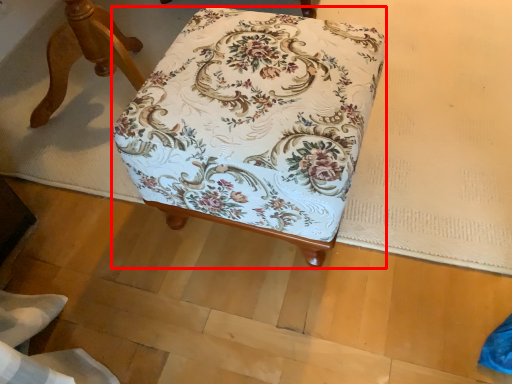
Question: In this image, where is furniture (annotated by the red box) located relative to furniture?

Choices:
 (A) right
 (B) left

Answer: (A)